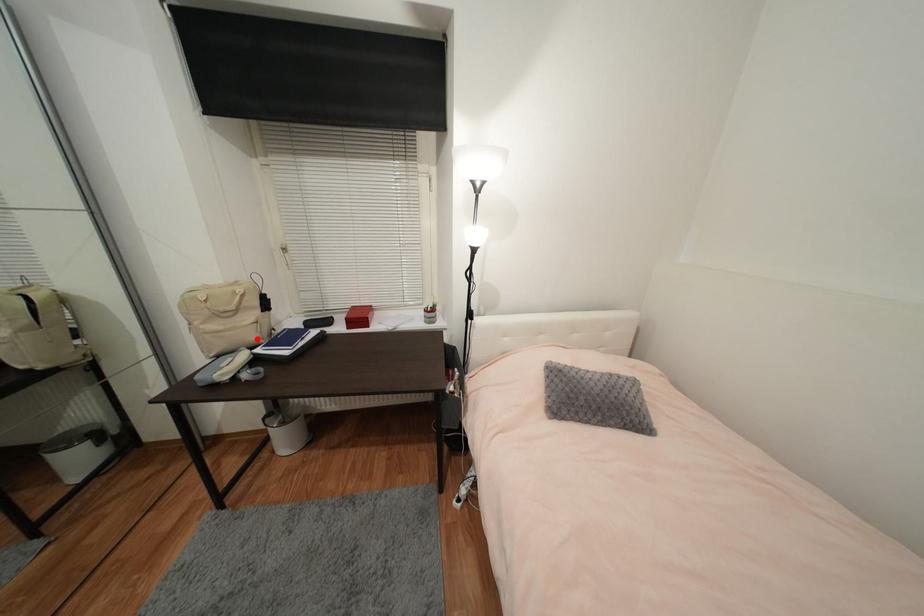
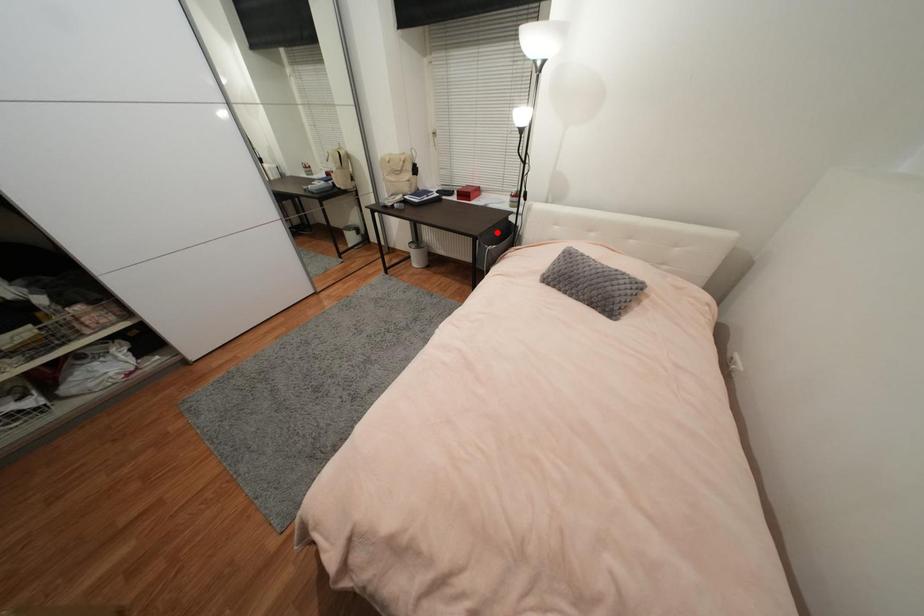
I am providing you with two images of the same scene from different viewpoints. A red point is marked on the first image and another point is marked on the second image. Is the marked point in image1 the same physical position as the marked point in image2?

No